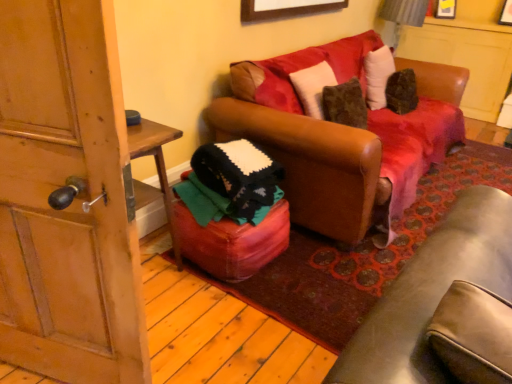
I want to click on vacant area that lies to the right of wooden door at left, so click(207, 339).